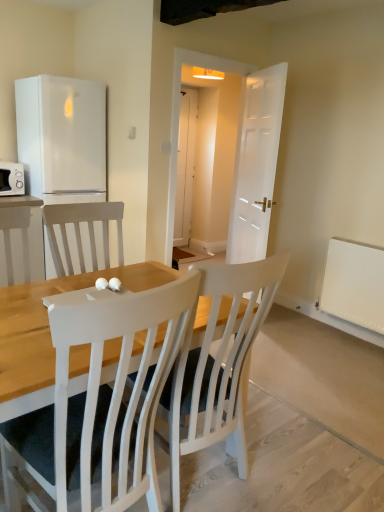
The height and width of the screenshot is (512, 384). Describe the element at coordinates (62, 138) in the screenshot. I see `white matte refrigerator at left` at that location.

This screenshot has width=384, height=512. In order to click on white matte radiator at lower right in this screenshot , I will do `click(354, 283)`.

Is white matte radiator at lower right not within white matte microwave at left?

white matte radiator at lower right lies outside white matte microwave at left's area.

Is white matte radiator at lower right looking in the opposite direction of white matte microwave at left?

No, white matte radiator at lower right's orientation is not away from white matte microwave at left.

From the image's perspective, would you say white matte radiator at lower right is shown under white matte microwave at left?

Indeed, from the image's perspective, white matte radiator at lower right is shown beneath white matte microwave at left.

How much distance is there between white wood chair at center and white matte radiator at lower right?

A distance of 2.31 meters exists between white wood chair at center and white matte radiator at lower right.

Is white wood chair at center positioned beyond the bounds of white matte radiator at lower right?

That's correct, white wood chair at center is outside of white matte radiator at lower right.

Does point (110, 472) come closer to viewer compared to point (353, 261)?

That is True.

From a real-world perspective, is white wood chair at center physically above white matte refrigerator at left?

No, from a real-world perspective, white wood chair at center is not above white matte refrigerator at left.

What's the angular difference between white wood chair at center and white matte refrigerator at left's facing directions?

The angle between the facing direction of white wood chair at center and the facing direction of white matte refrigerator at left is 0.0356 degrees.

Considering the sizes of objects white wood chair at center and white matte refrigerator at left in the image provided, who is taller, white wood chair at center or white matte refrigerator at left?

white matte refrigerator at left is taller.

You are a GUI agent. You are given a task and a screenshot of the screen. Output one action in this format:
    pyautogui.click(x=<x>, y=<y>)
    Task: Click on the chair lying on the right of white matte refrigerator at left
    This screenshot has height=512, width=384.
    Given the screenshot: What is the action you would take?
    pyautogui.click(x=99, y=403)

Considering the sizes of objects white matte radiator at lower right and white matte refrigerator at left in the image provided, who is smaller, white matte radiator at lower right or white matte refrigerator at left?

white matte radiator at lower right is smaller.

Considering the positions of objects white matte radiator at lower right and white matte refrigerator at left in the image provided, who is more to the right, white matte radiator at lower right or white matte refrigerator at left?

Positioned to the right is white matte radiator at lower right.

Is white matte radiator at lower right not within white matte refrigerator at left?

Absolutely, white matte radiator at lower right is external to white matte refrigerator at left.

Looking at this image, from a real-world perspective, is white matte radiator at lower right physically located above or below white matte refrigerator at left?

white matte radiator at lower right is situated lower than white matte refrigerator at left in the real world.

Is white matte microwave at left in contact with white matte radiator at lower right?

No, white matte microwave at left is not touching white matte radiator at lower right.

From the image's perspective, who appears lower, white matte microwave at left or white matte radiator at lower right?

From the image's view, white matte radiator at lower right is below.

Which of these two, white matte microwave at left or white matte radiator at lower right, stands taller?

Standing taller between the two is white matte radiator at lower right.

Measure the distance from white matte microwave at left to white matte radiator at lower right.

A distance of 2.68 meters exists between white matte microwave at left and white matte radiator at lower right.

From a real-world perspective, which is physically below, white matte microwave at left or white wood chair at center?

white wood chair at center, from a real-world perspective.

Is white matte microwave at left at the left side of white wood chair at center?

Yes, white matte microwave at left is to the left of white wood chair at center.

Can you confirm if white matte microwave at left is thinner than white wood chair at center?

Correct, the width of white matte microwave at left is less than that of white wood chair at center.

Does white matte refrigerator at left have a lesser height compared to white matte radiator at lower right?

No.

Which is in front, white matte refrigerator at left or white matte radiator at lower right?

white matte radiator at lower right is in front.

From a real-world perspective, between white matte refrigerator at left and white matte radiator at lower right, who is vertically higher?

white matte refrigerator at left is physically above.

The width and height of the screenshot is (384, 512). In order to click on radiator that is on the right side of white matte microwave at left in this screenshot , I will do `click(354, 283)`.

Locate an element on the screen. radiator behind the white wood chair at center is located at coordinates (354, 283).

When comparing their distances from white matte radiator at lower right, does white matte refrigerator at left or white matte microwave at left seem further?

Among the two, white matte microwave at left is located further to white matte radiator at lower right.

Based on their spatial positions, is white matte refrigerator at left or white matte radiator at lower right further from white wood chair at center?

The object further to white wood chair at center is white matte refrigerator at left.

Considering their positions, is white matte radiator at lower right positioned closer to white wood chair at center than white matte microwave at left?

Based on the image, white matte radiator at lower right appears to be nearer to white wood chair at center.

From the image, which object appears to be nearer to white matte refrigerator at left, white matte radiator at lower right or white matte microwave at left?

The object closer to white matte refrigerator at left is white matte microwave at left.

Based on their spatial positions, is white matte microwave at left or white matte radiator at lower right closer to white wood chair at center?

white matte radiator at lower right lies closer to white wood chair at center than the other object.

Which object lies further to the anchor point white matte microwave at left, white matte radiator at lower right or white matte refrigerator at left?

Among the two, white matte radiator at lower right is located further to white matte microwave at left.

Based on their spatial positions, is white matte radiator at lower right or white wood chair at center further from white matte microwave at left?

white matte radiator at lower right lies further to white matte microwave at left than the other object.

Which object lies further to the anchor point white matte refrigerator at left, white matte microwave at left or white matte radiator at lower right?

white matte radiator at lower right is positioned further to the anchor white matte refrigerator at left.

Image resolution: width=384 pixels, height=512 pixels. Find the location of `refrigerator between white wood chair at center and white matte microwave at left in the front-back direction`. refrigerator between white wood chair at center and white matte microwave at left in the front-back direction is located at coordinates (62, 138).

Locate an element on the screen. chair between white matte refrigerator at left and white matte radiator at lower right in the horizontal direction is located at coordinates click(99, 403).

I want to click on refrigerator situated between white matte microwave at left and white matte radiator at lower right from left to right, so click(62, 138).

Locate an element on the screen. chair situated between white matte microwave at left and white matte radiator at lower right from left to right is located at coordinates (99, 403).